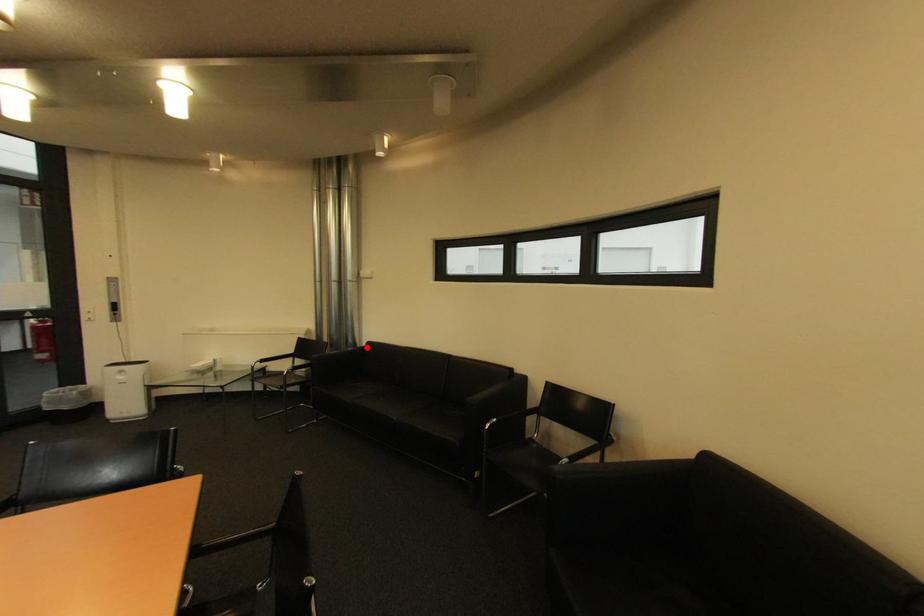
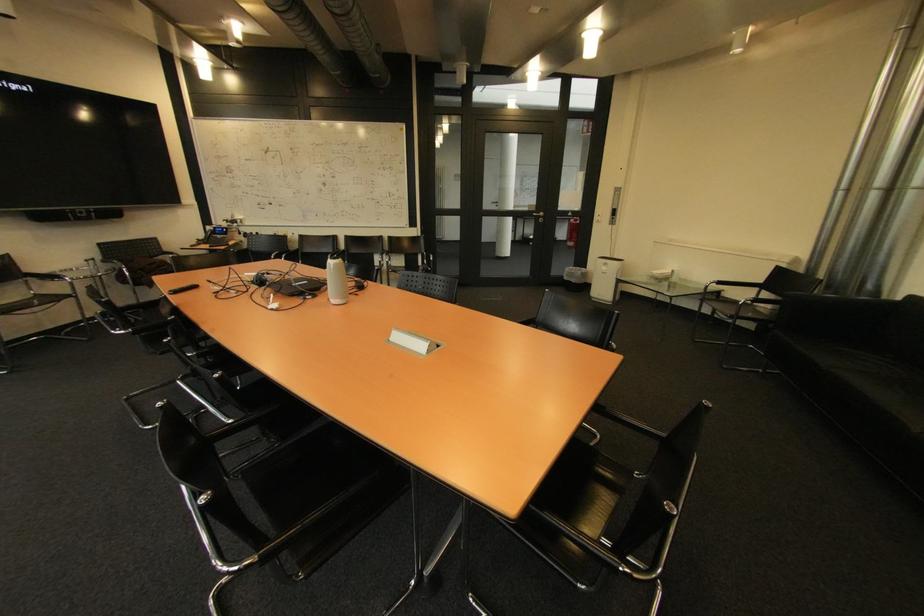
The point at the highlighted location is marked in the first image. Where is the corresponding point in the second image?

(893, 300)